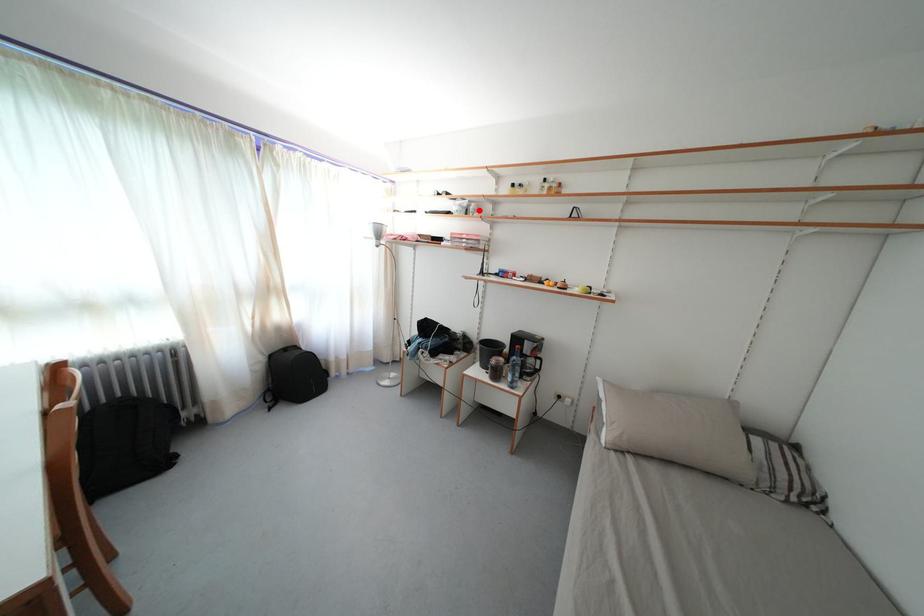
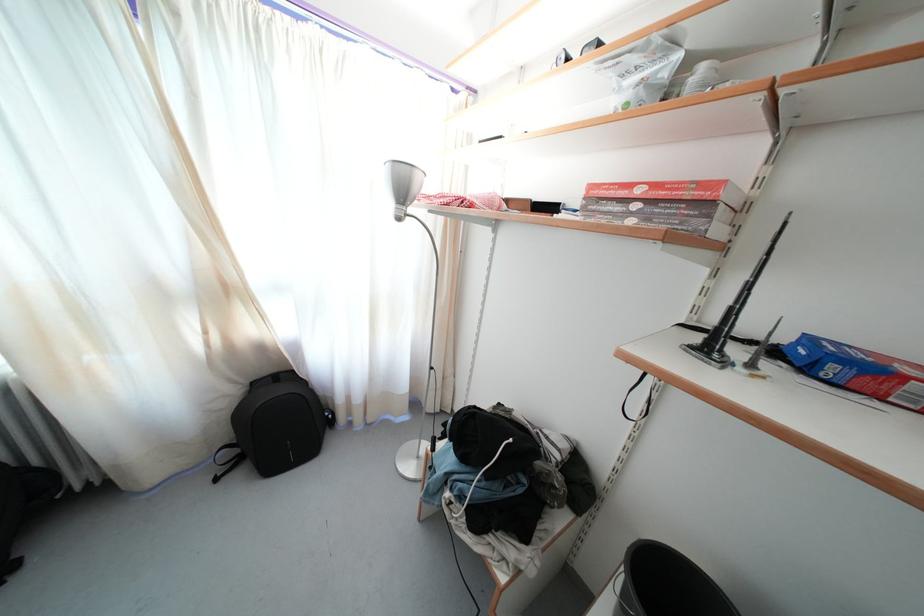
Question: I am providing you with two images of the same scene from different viewpoints. Given a red point in image1, look at the same physical point in image2. Is it:

Choices:
 (A) Closer to the viewpoint
 (B) Farther from the viewpoint

Answer: (B)